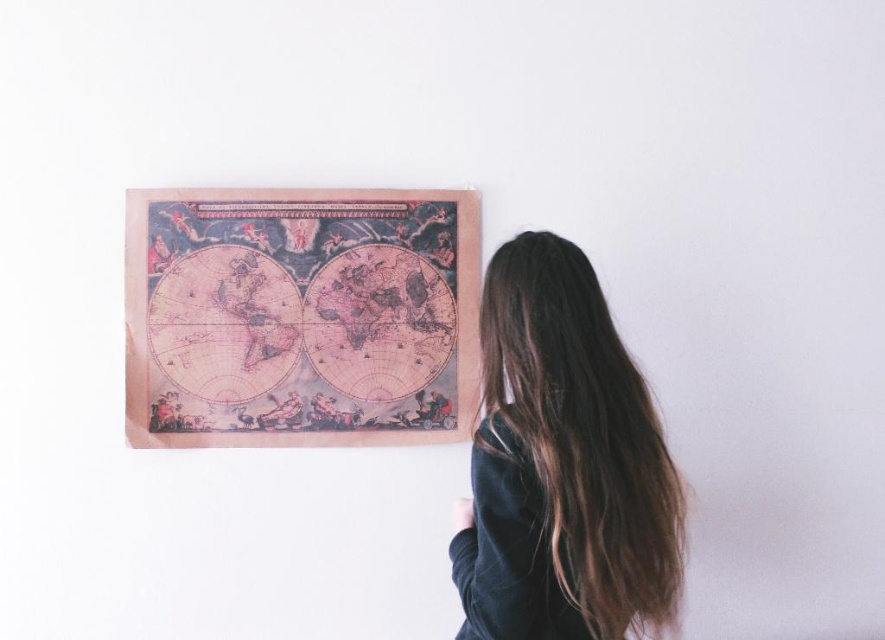
You are standing in a room with a vintage paper map at center and a dark brown hair at upper right. Which object is closer to you?

The vintage paper map at center is closer to you than the dark brown hair at upper right.

From the picture: You are a photographer trying to capture a shot of the vintage paper map at center and the dark brown hair at upper right. Based on their positions, which object is located to the left of the other?

The vintage paper map at center is positioned on the left side of dark brown hair at upper right, so the vintage paper map at center is to the left of the dark brown hair at upper right.

You are a photographer trying to capture the vintage paper map at center and the dark brown hair at upper right in a single frame. Based on their sizes, which object should you focus on to ensure both are clearly visible in the photo?

The vintage paper map at center is smaller than the dark brown hair at upper right. To ensure both are clearly visible, focus on the vintage paper map at center since it requires more attention due to its smaller size.